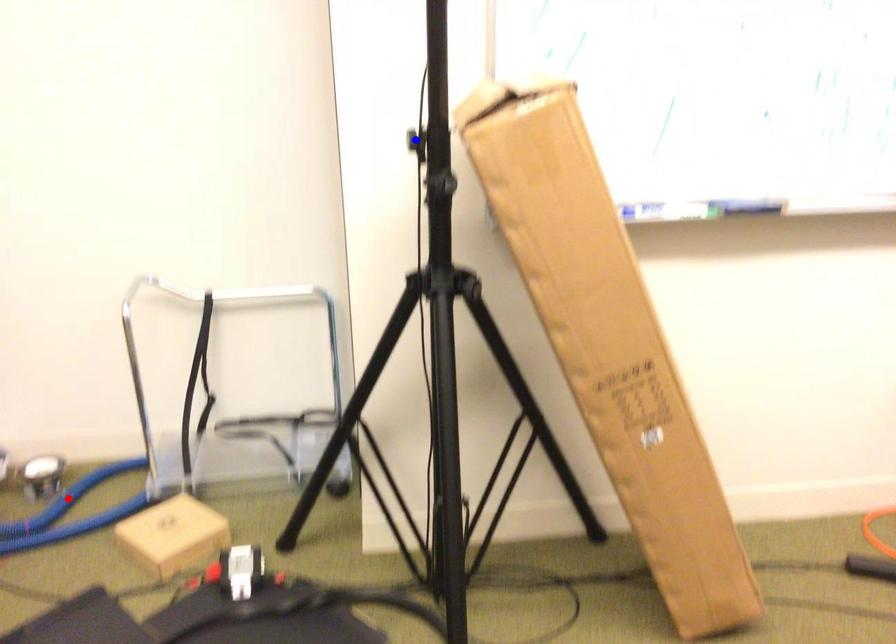
Question: Two points are marked on the image. Which point is closer to the camera?

Choices:
 (A) Blue point is closer.
 (B) Red point is closer.

Answer: (A)